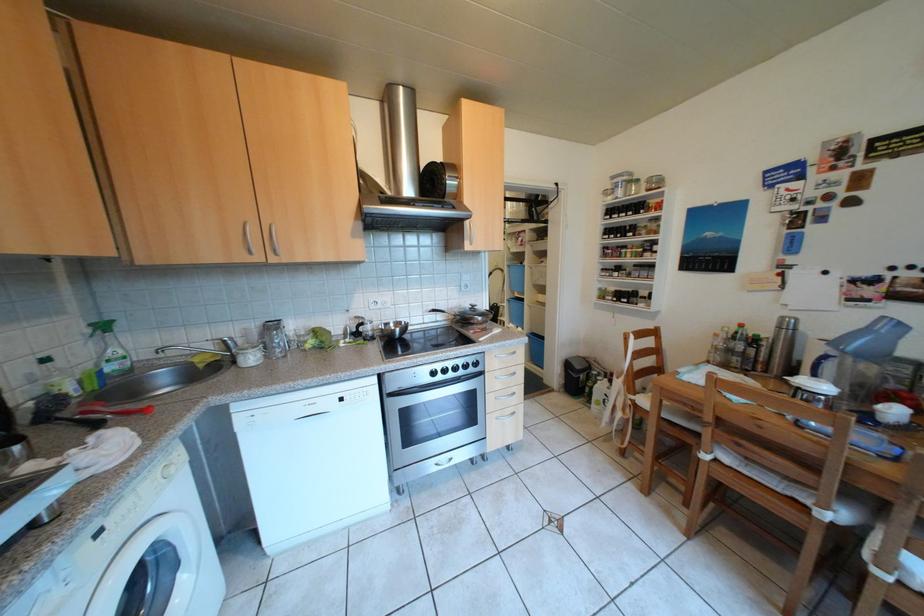
At what (x,y) coordinates should I click in order to perform the action: click on faucet handle. Please return your answer as a coordinate pair (x, y). Looking at the image, I should click on click(191, 350).